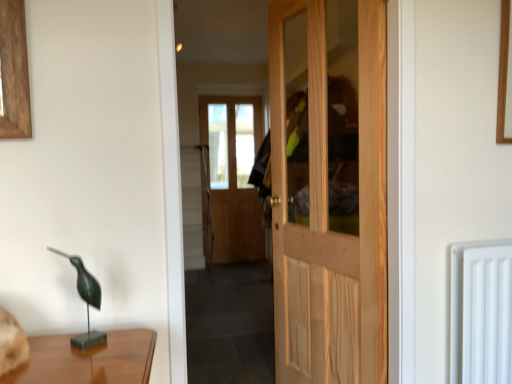
Question: Does green patina metal bird at left touch natural wood door at center?

Choices:
 (A) no
 (B) yes

Answer: (A)

Question: Does green patina metal bird at left have a smaller size compared to natural wood door at center?

Choices:
 (A) yes
 (B) no

Answer: (A)

Question: Is green patina metal bird at left bigger than natural wood door at center?

Choices:
 (A) no
 (B) yes

Answer: (A)

Question: Are green patina metal bird at left and natural wood door at center far apart?

Choices:
 (A) yes
 (B) no

Answer: (A)

Question: Is green patina metal bird at left at the left side of natural wood door at center?

Choices:
 (A) yes
 (B) no

Answer: (A)

Question: Can you confirm if green patina metal bird at left is positioned to the right of natural wood door at center?

Choices:
 (A) yes
 (B) no

Answer: (B)

Question: Is natural wood door at center bigger than green patina metal bird at left?

Choices:
 (A) yes
 (B) no

Answer: (A)

Question: From the image's perspective, is natural wood door at center above green patina metal bird at left?

Choices:
 (A) no
 (B) yes

Answer: (B)

Question: Considering the relative positions of natural wood door at center and green patina metal bird at left in the image provided, is natural wood door at center to the left of green patina metal bird at left from the viewer's perspective?

Choices:
 (A) yes
 (B) no

Answer: (B)

Question: Is natural wood door at center positioned far away from green patina metal bird at left?

Choices:
 (A) yes
 (B) no

Answer: (A)

Question: Could you tell me if natural wood door at center is turned towards green patina metal bird at left?

Choices:
 (A) no
 (B) yes

Answer: (B)

Question: Is natural wood door at center directly adjacent to green patina metal bird at left?

Choices:
 (A) no
 (B) yes

Answer: (A)

Question: Can you confirm if white plastic radiator at right is smaller than green patina metal bird at left?

Choices:
 (A) no
 (B) yes

Answer: (A)